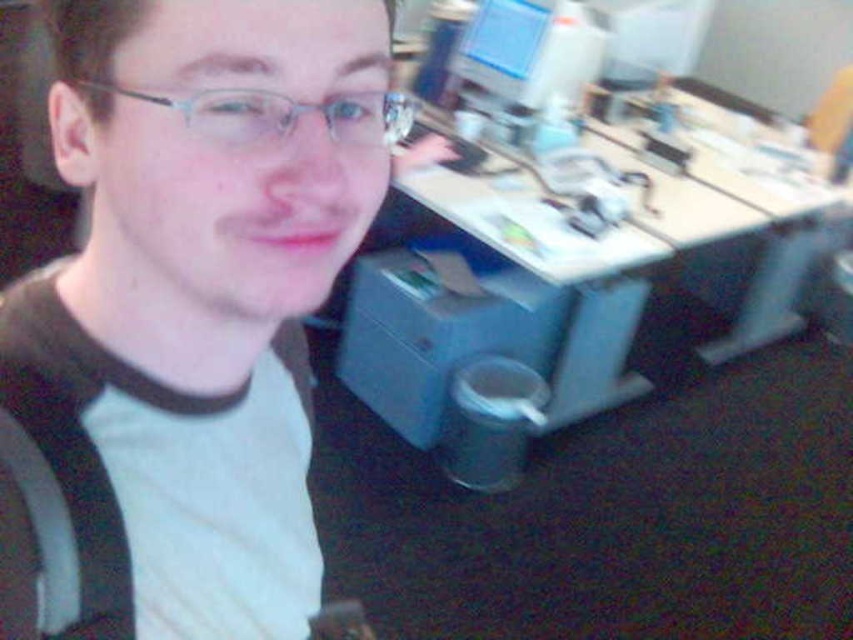
Does matte black shirt at center have a greater height compared to clear plastic glasses at upper center?

Correct, matte black shirt at center is much taller as clear plastic glasses at upper center.

Can you confirm if matte black shirt at center is bigger than clear plastic glasses at upper center?

Indeed, matte black shirt at center has a larger size compared to clear plastic glasses at upper center.

Is point (260, 381) in front of point (387, 97)?

No, (260, 381) is further to viewer.

Find the location of a particular element. matte black shirt at center is located at coordinates (186, 314).

From the picture: Can you confirm if blue plastic computer desk at center is bigger than clear plastic glasses at upper center?

Indeed, blue plastic computer desk at center has a larger size compared to clear plastic glasses at upper center.

Locate an element on the screen. The height and width of the screenshot is (640, 853). blue plastic computer desk at center is located at coordinates (596, 269).

This screenshot has height=640, width=853. I want to click on blue plastic computer desk at center, so click(x=596, y=269).

Who is lower down, matte black shirt at center or blue plastic computer desk at center?

matte black shirt at center is lower down.

Can you confirm if matte black shirt at center is positioned below blue plastic computer desk at center?

Yes.

You are a GUI agent. You are given a task and a screenshot of the screen. Output one action in this format:
    pyautogui.click(x=<x>, y=<y>)
    Task: Click on the matte black shirt at center
    
    Given the screenshot: What is the action you would take?
    pyautogui.click(x=186, y=314)